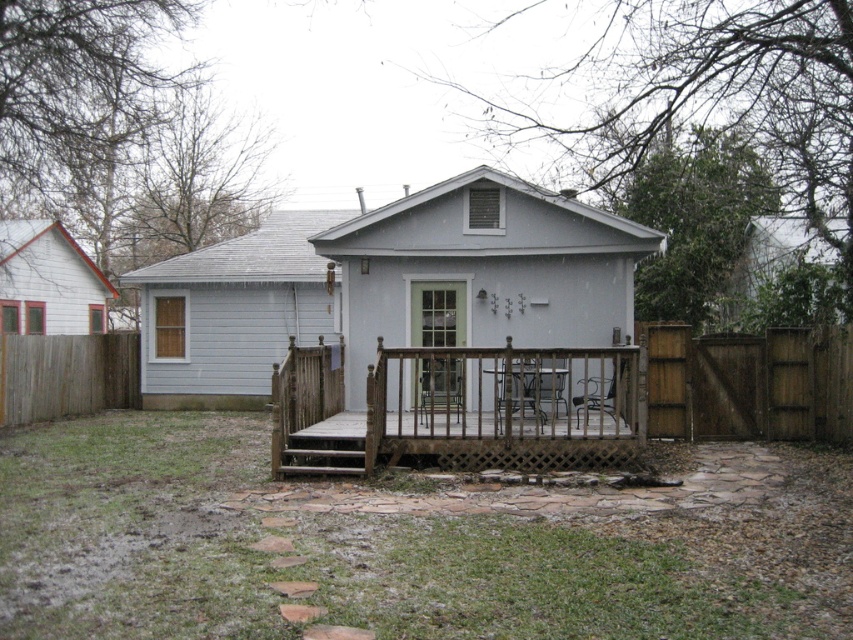
Question: Which object appears closest to the camera in this image?

Choices:
 (A) green glass screen door at center
 (B) green grass at center

Answer: (B)

Question: Is green grass at center smaller than brown wooden gate at right?

Choices:
 (A) no
 (B) yes

Answer: (A)

Question: Which point is farther to the camera?

Choices:
 (A) weathered wood porch at center
 (B) green grass at center
 (C) brown wooden gate at right

Answer: (C)

Question: Which of the following is the closest to the observer?

Choices:
 (A) green glass screen door at center
 (B) brown wooden fence at lower left

Answer: (A)

Question: Can you confirm if weathered wood porch at center is positioned to the right of green glass screen door at center?

Choices:
 (A) no
 (B) yes

Answer: (B)

Question: Is green grass at center below weathered wood porch at center?

Choices:
 (A) no
 (B) yes

Answer: (B)